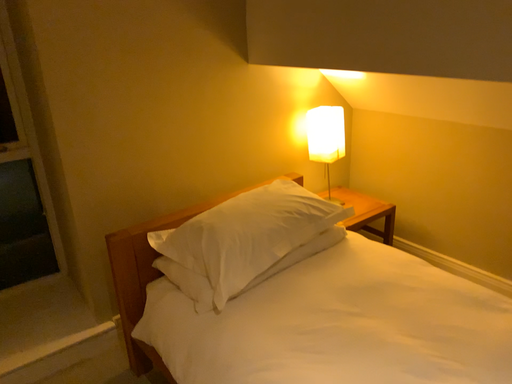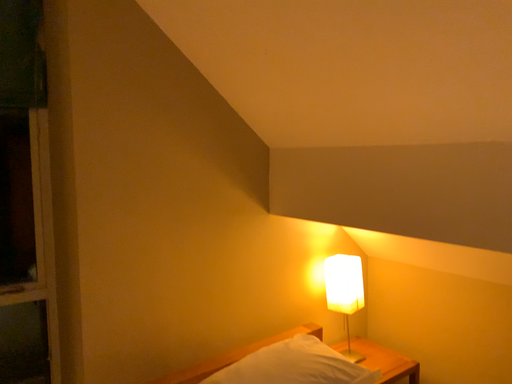
Question: How did the camera likely rotate when shooting the video?

Choices:
 (A) rotated downward
 (B) rotated upward

Answer: (B)